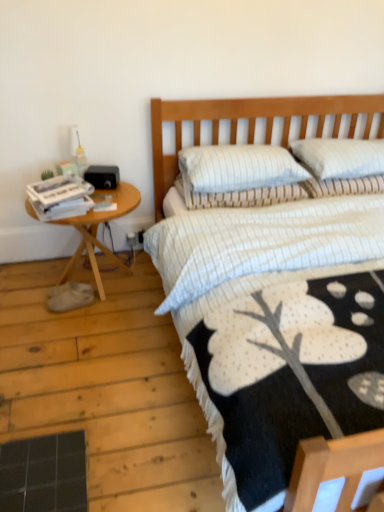
What do you see at coordinates (247, 129) in the screenshot?
I see `white striped fabric at center` at bounding box center [247, 129].

The height and width of the screenshot is (512, 384). What do you see at coordinates (250, 197) in the screenshot?
I see `white striped pillow at center, arranged as the third pillow when viewed from the right` at bounding box center [250, 197].

Where is `white paper magazines at left`? white paper magazines at left is located at coordinates point(60,197).

Locate an element on the screen. white striped fabric at center is located at coordinates (247, 129).

Which is correct: white paper magazines at left is inside white striped pillow at center, arranged as the third pillow when viewed from the right, or outside of it?

white paper magazines at left is outside white striped pillow at center, arranged as the third pillow when viewed from the right.

Is white paper magazines at left turned away from white striped pillow at center, arranged as the third pillow when viewed from the right?

white paper magazines at left is not turned away from white striped pillow at center, arranged as the third pillow when viewed from the right.

Looking at their sizes, would you say white paper magazines at left is wider or thinner than white striped pillow at center, arranged as the third pillow when viewed from the right?

white paper magazines at left is thinner than white striped pillow at center, arranged as the third pillow when viewed from the right.

Between white striped pillow at center, arranged as the third pillow when viewed from the right, and white paper magazines at left, which one has smaller width?

With smaller width is white paper magazines at left.

Is point (312, 191) closer or farther from the camera than point (50, 211)?

Point (312, 191) is positioned farther from the camera compared to point (50, 211).

Which is in front, white striped pillow at center, the first pillow viewed from the left, or white paper magazines at left?

white paper magazines at left is in front.

Is woodenwoodenside table at left looking in the opposite direction of white striped pillow at upper right, which is the first pillow in right-to-left order?

No, woodenwoodenside table at left is not facing the opposite direction of white striped pillow at upper right, which is the first pillow in right-to-left order.

From a real-world perspective, is woodenwoodenside table at left under white striped pillow at upper right, which is the first pillow in right-to-left order?

Yes, from a real-world perspective, woodenwoodenside table at left is below white striped pillow at upper right, which is the first pillow in right-to-left order.

Does point (29, 209) come closer to viewer compared to point (343, 151)?

Yes, it is.

Is woodenwoodenside table at left with white striped pillow at upper right, which appears as the 3th pillow when viewed from the left?

There is a gap between woodenwoodenside table at left and white striped pillow at upper right, which appears as the 3th pillow when viewed from the left.

Which object is closer to the camera, white striped pillow at center, acting as the 2th pillow starting from the right, or white striped pillow at center, the first pillow viewed from the left?

Positioned in front is white striped pillow at center, acting as the 2th pillow starting from the right.

In terms of width, does white striped pillow at center, which is counted as the 2th pillow, starting from the left, look wider or thinner when compared to white striped pillow at center, the first pillow viewed from the left?

Considering their sizes, white striped pillow at center, which is counted as the 2th pillow, starting from the left, looks slimmer than white striped pillow at center, the first pillow viewed from the left.

Looking at the image, does white striped pillow at center, which is counted as the 2th pillow, starting from the left, seem bigger or smaller compared to white striped pillow at center, the first pillow viewed from the left?

white striped pillow at center, which is counted as the 2th pillow, starting from the left, is bigger than white striped pillow at center, the first pillow viewed from the left.

From the image's perspective, who appears lower, white striped pillow at center, which is counted as the 2th pillow, starting from the left, or white striped pillow at center, the first pillow viewed from the left?

white striped pillow at center, the first pillow viewed from the left, is shown below in the image.

Is white paper magazines at left turned away from white striped pillow at upper right, which appears as the 3th pillow when viewed from the left?

No, white paper magazines at left's orientation is not away from white striped pillow at upper right, which appears as the 3th pillow when viewed from the left.

From the image's perspective, which is below, white paper magazines at left or white striped pillow at upper right, which is the first pillow in right-to-left order?

white paper magazines at left, from the image's perspective.

Is white paper magazines at left taller or shorter than white striped pillow at upper right, which is the first pillow in right-to-left order?

Clearly, white paper magazines at left is shorter compared to white striped pillow at upper right, which is the first pillow in right-to-left order.

Considering the positions of point (85, 206) and point (383, 169), is point (85, 206) closer or farther from the camera than point (383, 169)?

Point (85, 206) is closer to the camera than point (383, 169).

Could you tell me if woodenwoodenside table at left is facing white striped pillow at center, arranged as the third pillow when viewed from the right?

No, woodenwoodenside table at left is not facing towards white striped pillow at center, arranged as the third pillow when viewed from the right.

From the picture: Is woodenwoodenside table at left to the left or to the right of white striped pillow at center, arranged as the third pillow when viewed from the right, in the image?

Based on their positions, woodenwoodenside table at left is located to the left of white striped pillow at center, arranged as the third pillow when viewed from the right.

From the picture: Which of these two, woodenwoodenside table at left or white striped pillow at center, the first pillow viewed from the left, is smaller?

Smaller between the two is white striped pillow at center, the first pillow viewed from the left.

Identify the location of table below the white striped pillow at center, arranged as the third pillow when viewed from the right (from the image's perspective). 96,231.

Is white striped pillow at upper right, which is the first pillow in right-to-left order, far from white striped pillow at center, which is counted as the 2th pillow, starting from the left?

Actually, white striped pillow at upper right, which is the first pillow in right-to-left order, and white striped pillow at center, which is counted as the 2th pillow, starting from the left, are a little close together.

From the image's perspective, between white striped pillow at upper right, which appears as the 3th pillow when viewed from the left, and white striped pillow at center, which is counted as the 2th pillow, starting from the left, who is located below?

white striped pillow at center, which is counted as the 2th pillow, starting from the left, appears lower in the image.

Which point is more distant from viewer, (352, 151) or (265, 168)?

The point (352, 151) is farther.

How different are the orientations of white striped pillow at upper right, which appears as the 3th pillow when viewed from the left, and white striped pillow at center, acting as the 2th pillow starting from the right, in degrees?

white striped pillow at upper right, which appears as the 3th pillow when viewed from the left, and white striped pillow at center, acting as the 2th pillow starting from the right, are facing 0.00114 degrees away from each other.

Locate an element on the screen. The width and height of the screenshot is (384, 512). the 2nd pillow behind the white paper magazines at left is located at coordinates (250, 197).

Where is `magazine that appears below the white striped pillow at center, arranged as the third pillow when viewed from the right (from the image's perspective)`? magazine that appears below the white striped pillow at center, arranged as the third pillow when viewed from the right (from the image's perspective) is located at coordinates (60, 197).

Based on their spatial positions, is white paper magazines at left or woodenwoodenside table at left closer to white striped pillow at upper right, which is the first pillow in right-to-left order?

Among the two, woodenwoodenside table at left is located nearer to white striped pillow at upper right, which is the first pillow in right-to-left order.

Estimate the real-world distances between objects in this image. Which object is further from white striped pillow at center, arranged as the third pillow when viewed from the right, white striped fabric at center or white striped pillow at upper right, which appears as the 3th pillow when viewed from the left?

white striped fabric at center.

Based on their spatial positions, is woodenwoodenside table at left or white striped pillow at center, acting as the 2th pillow starting from the right, closer to white striped pillow at center, arranged as the third pillow when viewed from the right?

white striped pillow at center, acting as the 2th pillow starting from the right, is closer to white striped pillow at center, arranged as the third pillow when viewed from the right.

Which object lies nearer to the anchor point white striped pillow at upper right, which appears as the 3th pillow when viewed from the left, woodenwoodenside table at left or white paper magazines at left?

woodenwoodenside table at left.

When comparing their distances from white striped fabric at center, does white striped pillow at center, the first pillow viewed from the left, or woodenwoodenside table at left seem further?

woodenwoodenside table at left.

Which object lies nearer to the anchor point white paper magazines at left, white striped pillow at upper right, which appears as the 3th pillow when viewed from the left, or white striped pillow at center, the first pillow viewed from the left?

The object closer to white paper magazines at left is white striped pillow at center, the first pillow viewed from the left.

From the image, which object appears to be farther from white striped pillow at center, the first pillow viewed from the left, woodenwoodenside table at left or white paper magazines at left?

white paper magazines at left is further to white striped pillow at center, the first pillow viewed from the left.

Based on their spatial positions, is white striped pillow at upper right, which is the first pillow in right-to-left order, or white striped fabric at center further from white paper magazines at left?

The object further to white paper magazines at left is white striped pillow at upper right, which is the first pillow in right-to-left order.

You are a GUI agent. You are given a task and a screenshot of the screen. Output one action in this format:
    pyautogui.click(x=<x>, y=<y>)
    Task: Click on the pillow situated between white paper magazines at left and white striped pillow at center, which is counted as the 2th pillow, starting from the left, from left to right
    
    Given the screenshot: What is the action you would take?
    pyautogui.click(x=250, y=197)

The width and height of the screenshot is (384, 512). Find the location of `table positioned between white striped fabric at center and white striped pillow at upper right, which appears as the 3th pillow when viewed from the left, from near to far`. table positioned between white striped fabric at center and white striped pillow at upper right, which appears as the 3th pillow when viewed from the left, from near to far is located at coordinates (96, 231).

The width and height of the screenshot is (384, 512). In order to click on pillow between white striped pillow at center, the first pillow viewed from the left, and white striped pillow at upper right, which is the first pillow in right-to-left order, from left to right in this screenshot , I will do `click(237, 168)`.

Where is `magazine between white striped fabric at center and white striped pillow at center, the first pillow viewed from the left, from front to back`? magazine between white striped fabric at center and white striped pillow at center, the first pillow viewed from the left, from front to back is located at coordinates (60, 197).